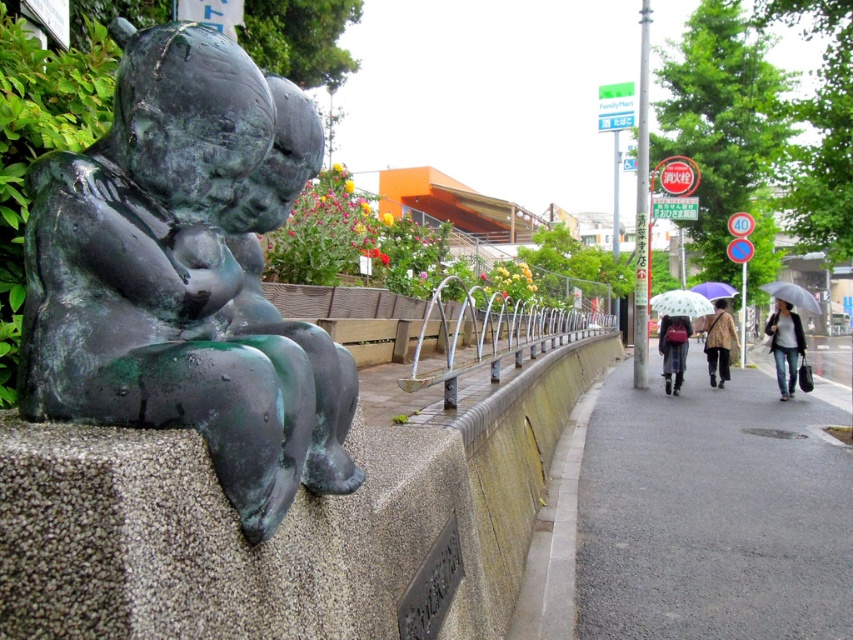
You are standing at the base of the bronze sculpture on the textured concrete wall. You want to walk directly to the point marked at coordinates [712,515]. Which direction should you head from your current position?

You should head towards the lower right direction from the bronze sculpture on the textured concrete wall to reach the point marked at coordinates [712,515], as it is located on the gray asphalt pavement at lower right.

In the scene shown: You are standing at the center of the image and want to walk to the gray asphalt pavement at lower right. According to the coordinates provided, in which direction should you move relative to your current position?

The gray asphalt pavement at lower right is located at point (712, 515), which is to the lower right direction from your current position at the center. Move towards the lower right direction to reach it.